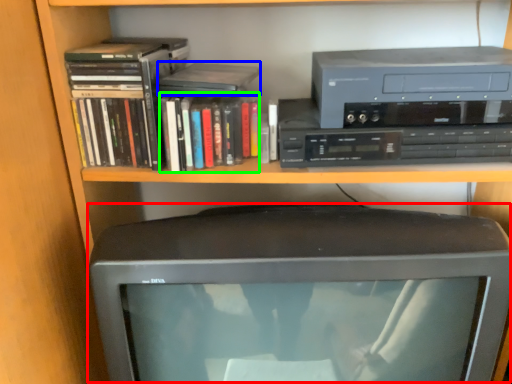
Question: Which object is positioned closest to computer monitor (highlighted by a red box)? Select from paperback book (highlighted by a blue box) and book (highlighted by a green box).

Choices:
 (A) paperback book
 (B) book

Answer: (B)